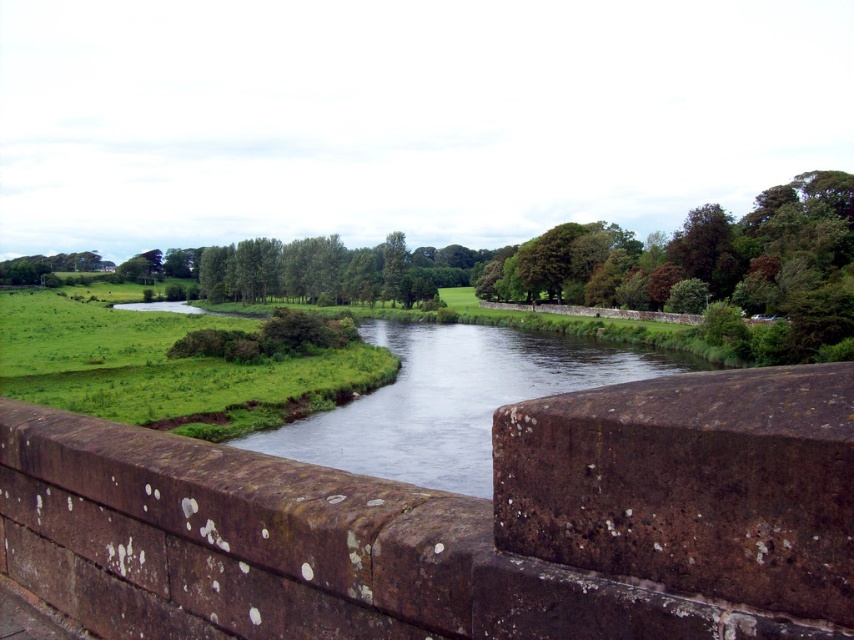
Who is positioned more to the left, brown stone ledge at center or clear water at center?

brown stone ledge at center is more to the left.

Is brown stone ledge at center taller than clear water at center?

In fact, brown stone ledge at center may be shorter than clear water at center.

Who is more distant from viewer, (273, 540) or (389, 346)?

The point (389, 346) is behind.

Locate an element on the screen. This screenshot has height=640, width=854. brown stone ledge at center is located at coordinates (297, 548).